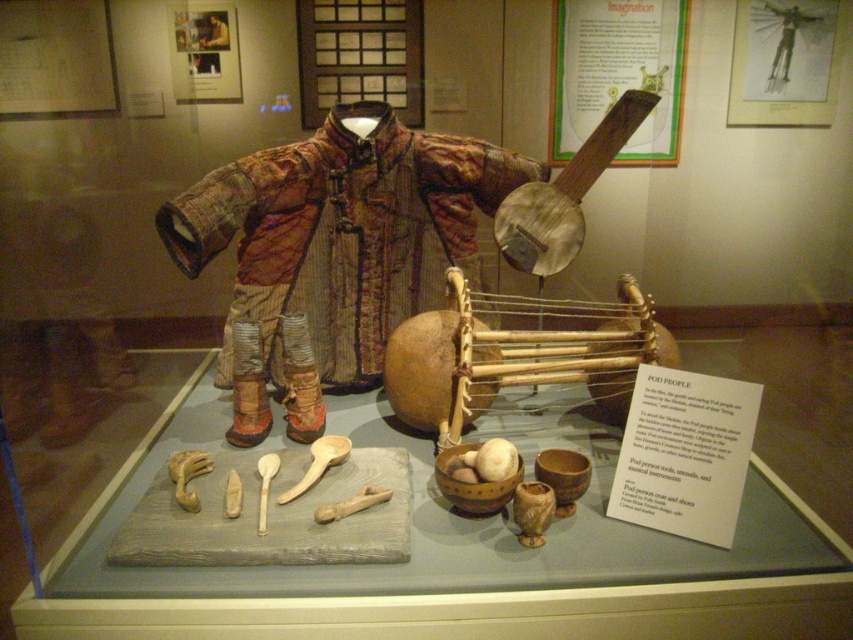
Question: Can you confirm if textured brown fabric coat at center is wider than wooden banjo at upper center?

Choices:
 (A) yes
 (B) no

Answer: (A)

Question: Considering the relative positions of textured brown fabric coat at center and wooden banjo at upper center in the image provided, where is textured brown fabric coat at center located with respect to wooden banjo at upper center?

Choices:
 (A) above
 (B) below

Answer: (B)

Question: Which of the following is the closest to the observer?

Choices:
 (A) (274, 355)
 (B) (549, 256)

Answer: (A)

Question: Can you confirm if textured brown fabric coat at center is smaller than wooden banjo at upper center?

Choices:
 (A) no
 (B) yes

Answer: (A)

Question: Which of the following is the closest to the observer?

Choices:
 (A) textured brown fabric coat at center
 (B) wooden banjo at upper center

Answer: (A)